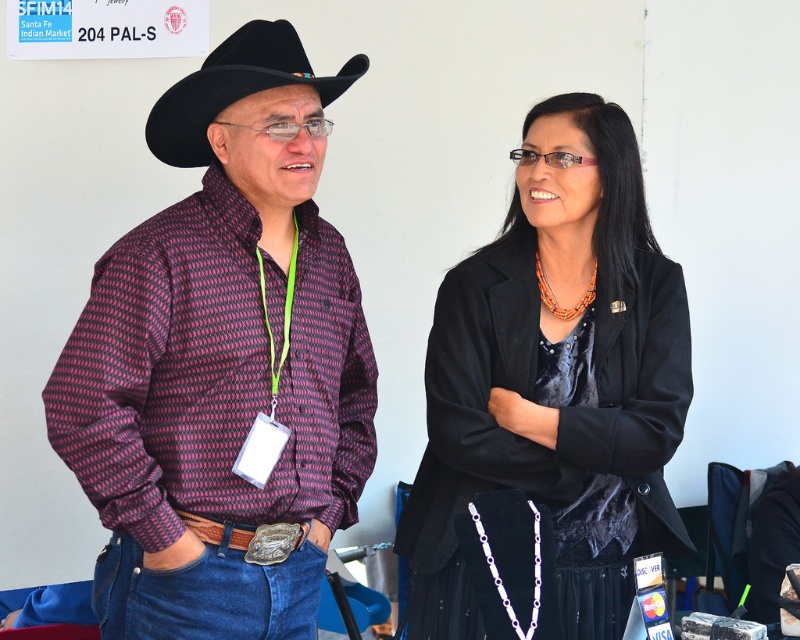
Does plaid shirt at center have a greater height compared to black felt cowboy hat at upper left?

Indeed, plaid shirt at center has a greater height compared to black felt cowboy hat at upper left.

Which is more to the right, plaid shirt at center or black felt cowboy hat at upper left?

black felt cowboy hat at upper left is more to the right.

Find the location of a particular element. The image size is (800, 640). plaid shirt at center is located at coordinates (224, 364).

Is plaid shirt at center shorter than black velvet skirt at center?

No, plaid shirt at center is not shorter than black velvet skirt at center.

Does plaid shirt at center lie in front of black velvet skirt at center?

Yes, it is in front of black velvet skirt at center.

Which is in front, point (93, 432) or point (478, 465)?

Point (93, 432)

You are a GUI agent. You are given a task and a screenshot of the screen. Output one action in this format:
    pyautogui.click(x=<x>, y=<y>)
    Task: Click on the plaid shirt at center
    
    Given the screenshot: What is the action you would take?
    pyautogui.click(x=224, y=364)

Between black velvet skirt at center and black felt cowboy hat at upper left, which one has less height?

Standing shorter between the two is black felt cowboy hat at upper left.

Does black velvet skirt at center have a larger size compared to black felt cowboy hat at upper left?

Indeed, black velvet skirt at center has a larger size compared to black felt cowboy hat at upper left.

The image size is (800, 640). I want to click on black velvet skirt at center, so pyautogui.click(x=556, y=378).